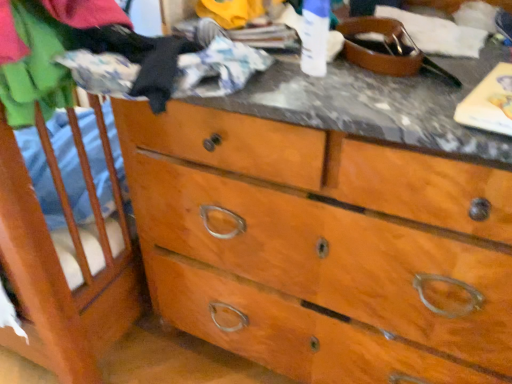
Question: From the image's perspective, is wooden dresser at center located above soft cotton shirt at left?

Choices:
 (A) no
 (B) yes

Answer: (A)

Question: Can you confirm if wooden dresser at center is positioned to the right of soft cotton shirt at left?

Choices:
 (A) no
 (B) yes

Answer: (B)

Question: Is wooden dresser at center placed right next to soft cotton shirt at left?

Choices:
 (A) yes
 (B) no

Answer: (B)

Question: From a real-world perspective, is wooden dresser at center positioned over soft cotton shirt at left based on gravity?

Choices:
 (A) yes
 (B) no

Answer: (B)

Question: Does wooden dresser at center have a greater width compared to soft cotton shirt at left?

Choices:
 (A) no
 (B) yes

Answer: (B)

Question: Is wooden dresser at center shorter than soft cotton shirt at left?

Choices:
 (A) no
 (B) yes

Answer: (A)

Question: Does soft cotton shirt at left have a smaller size compared to wooden dresser at center?

Choices:
 (A) yes
 (B) no

Answer: (A)

Question: Is soft cotton shirt at left bigger than wooden dresser at center?

Choices:
 (A) yes
 (B) no

Answer: (B)

Question: From a real-world perspective, is soft cotton shirt at left under wooden dresser at center?

Choices:
 (A) no
 (B) yes

Answer: (A)

Question: Can you confirm if soft cotton shirt at left is positioned to the left of wooden dresser at center?

Choices:
 (A) no
 (B) yes

Answer: (B)

Question: Does soft cotton shirt at left contain wooden dresser at center?

Choices:
 (A) no
 (B) yes

Answer: (A)

Question: Is soft cotton shirt at left facing towards wooden dresser at center?

Choices:
 (A) no
 (B) yes

Answer: (A)

Question: From the image's perspective, is wooden dresser at center above or below soft cotton shirt at left?

Choices:
 (A) above
 (B) below

Answer: (B)